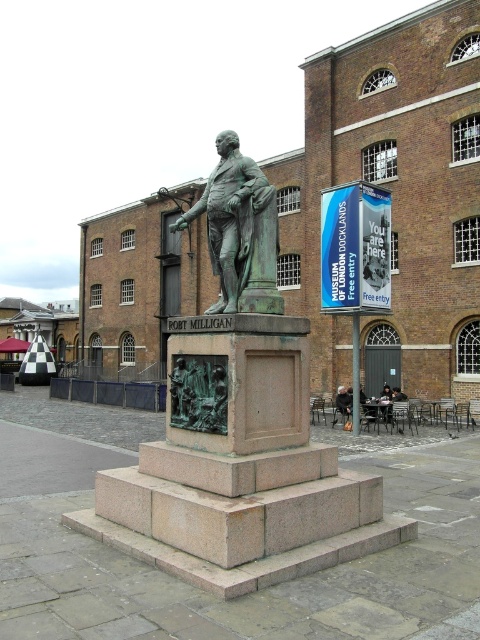
You are a photographer wanting to capture both the bronze statue at center and the dark brown leather jacket at lower center in a single shot. Can you position yourself so that both are visible without one blocking the other?

The bronze statue at center is in front of the dark brown leather jacket at lower center, so positioning yourself to the side or at an angle where you can see around the statue would allow both to be visible in the shot.

You are a photographer trying to capture a full view of the bronze statue at center without any obstruction. There is a dark brown leather jacket at lower center in the way. Can you move the jacket to the side to get a clear shot?

The bronze statue at center is taller than the dark brown leather jacket at lower center. Since the statue is taller, moving the jacket to the side would allow you to capture the full view of the bronze statue at center without obstruction.